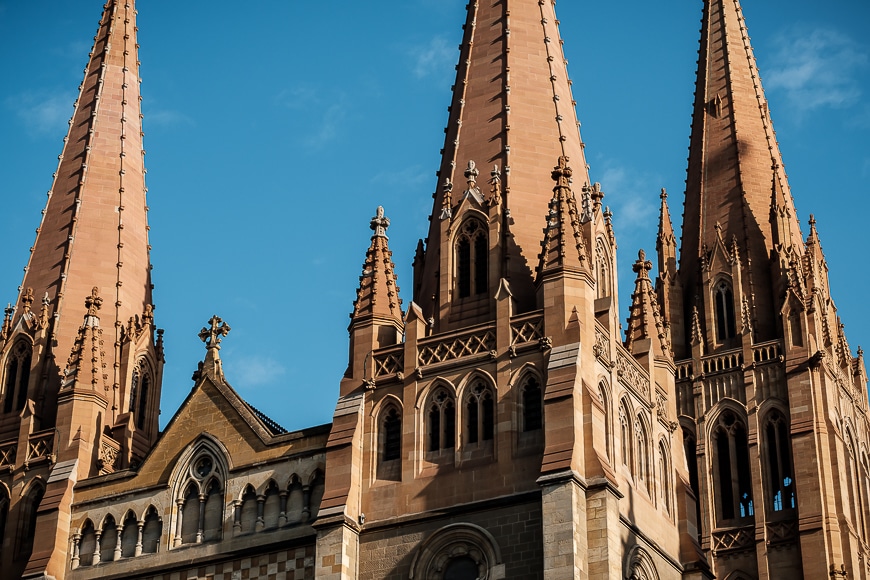
At what (x,y) coordinates should I click in order to perform the action: click on column. Please return your answer as a coordinate pair (x, y). The width and height of the screenshot is (870, 580). Looking at the image, I should click on (197, 518), (232, 516), (258, 513), (280, 513), (299, 509).